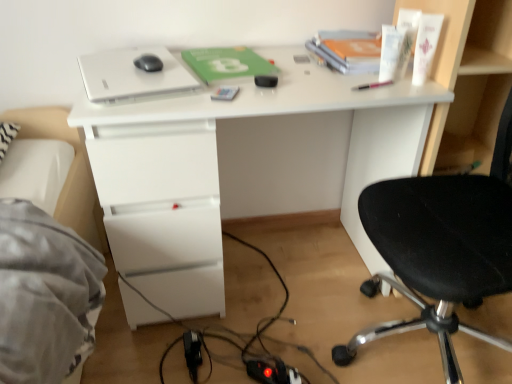
Question: Is metallic silver phone at center, positioned as the 2th stationery in right-to-left order, at the back of black fabric chair at right?

Choices:
 (A) no
 (B) yes

Answer: (A)

Question: From a real-world perspective, does black fabric chair at right stand above metallic silver phone at center, the first stationery from the left?

Choices:
 (A) yes
 (B) no

Answer: (B)

Question: Is black fabric chair at right taller than metallic silver phone at center, positioned as the 2th stationery in right-to-left order?

Choices:
 (A) yes
 (B) no

Answer: (A)

Question: Would you consider black fabric chair at right to be distant from metallic silver phone at center, positioned as the 2th stationery in right-to-left order?

Choices:
 (A) no
 (B) yes

Answer: (A)

Question: Is the surface of black fabric chair at right in direct contact with metallic silver phone at center, the first stationery from the left?

Choices:
 (A) yes
 (B) no

Answer: (B)

Question: Considering the relative positions of black matte mouse at upper center and white matte book at upper right in the image provided, is black matte mouse at upper center to the left or to the right of white matte book at upper right?

Choices:
 (A) left
 (B) right

Answer: (A)

Question: Considering the positions of black matte mouse at upper center and white matte book at upper right in the image, is black matte mouse at upper center taller or shorter than white matte book at upper right?

Choices:
 (A) tall
 (B) short

Answer: (B)

Question: In terms of size, does black matte mouse at upper center appear bigger or smaller than white matte book at upper right?

Choices:
 (A) big
 (B) small

Answer: (B)

Question: Looking at their shapes, would you say black matte mouse at upper center is wider or thinner than white matte book at upper right?

Choices:
 (A) thin
 (B) wide

Answer: (A)

Question: Considering their positions, is pink plastic pen at upper right, positioned as the 1th stationery in right-to-left order, located in front of or behind white matte book at upper right?

Choices:
 (A) behind
 (B) front

Answer: (B)

Question: From a real-world perspective, is pink plastic pen at upper right, which is the second stationery from left to right, above or below white matte book at upper right?

Choices:
 (A) above
 (B) below

Answer: (B)

Question: Considering the positions of pink plastic pen at upper right, which is the second stationery from left to right, and white matte book at upper right in the image, is pink plastic pen at upper right, which is the second stationery from left to right, taller or shorter than white matte book at upper right?

Choices:
 (A) short
 (B) tall

Answer: (A)

Question: Is pink plastic pen at upper right, which is the second stationery from left to right, to the left or to the right of white matte book at upper right in the image?

Choices:
 (A) left
 (B) right

Answer: (A)

Question: Does point (224, 97) appear closer or farther from the camera than point (353, 89)?

Choices:
 (A) farther
 (B) closer

Answer: (B)

Question: Considering their positions, is metallic silver phone at center, positioned as the 2th stationery in right-to-left order, located in front of or behind pink plastic pen at upper right, positioned as the 1th stationery in right-to-left order?

Choices:
 (A) behind
 (B) front

Answer: (B)